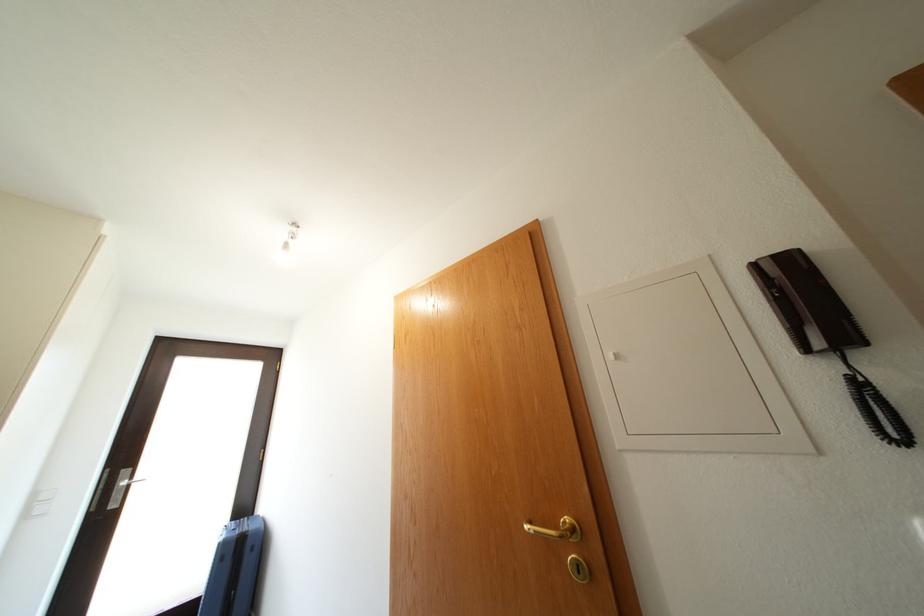
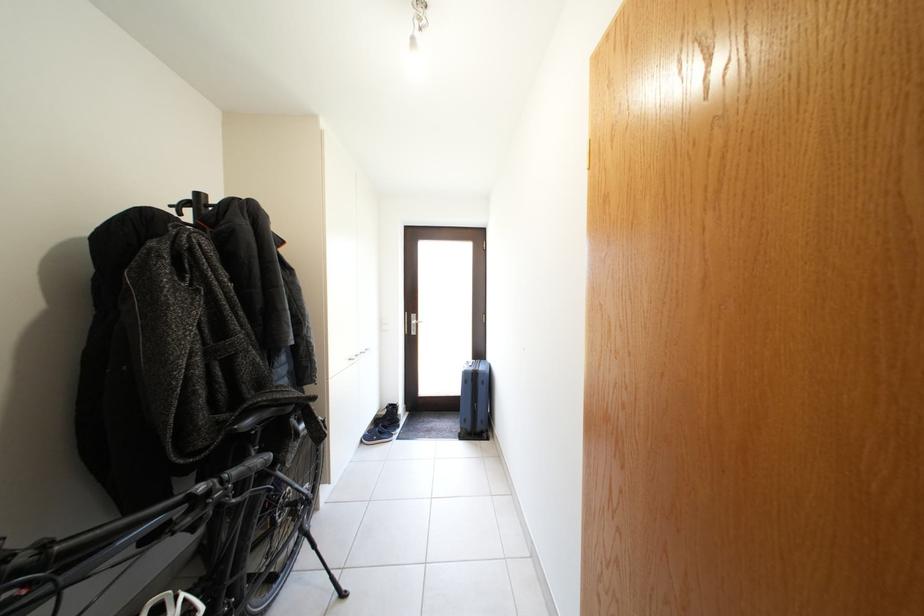
Locate, in the second image, the point that corresponds to the point at 233,549 in the first image.

(473, 379)